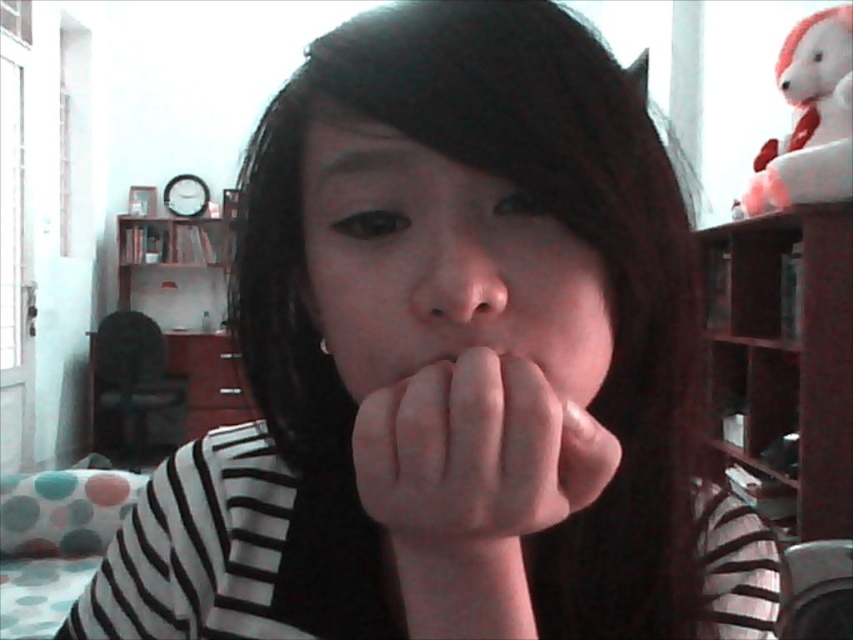
Is pink flesh-colored hand at center smaller than pink matte lips at center?

No.

Is pink flesh-colored hand at center to the left of pink matte lips at center from the viewer's perspective?

Correct, you'll find pink flesh-colored hand at center to the left of pink matte lips at center.

What do you see at coordinates (476, 456) in the screenshot? I see `pink flesh-colored hand at center` at bounding box center [476, 456].

The height and width of the screenshot is (640, 853). In order to click on pink flesh-colored hand at center in this screenshot , I will do `click(476, 456)`.

Describe the element at coordinates (808, 118) in the screenshot. I see `white plush bear at upper right` at that location.

Looking at this image, can you confirm if white plush bear at upper right is taller than smooth skin nose at center?

Yes, white plush bear at upper right is taller than smooth skin nose at center.

Identify the location of white plush bear at upper right. (808, 118).

Locate an element on the screen. white plush bear at upper right is located at coordinates (x=808, y=118).

How far apart are white plush bear at upper right and pink matte lips at center?

white plush bear at upper right is 7.29 feet from pink matte lips at center.

Which is more to the right, white plush bear at upper right or pink matte lips at center?

Positioned to the right is white plush bear at upper right.

Find the location of a particular element. This screenshot has width=853, height=640. white plush bear at upper right is located at coordinates (808, 118).

This screenshot has width=853, height=640. Identify the location of white plush bear at upper right. (808, 118).